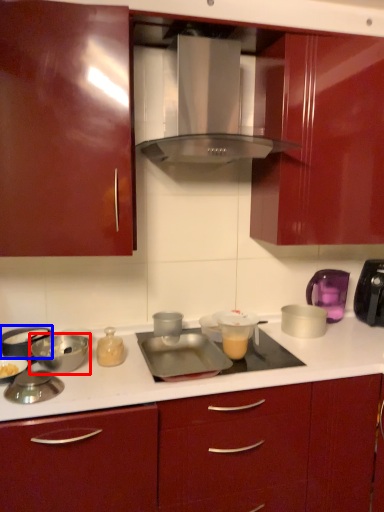
Question: Which of the following is the farthest to the observer, bowl (highlighted by a red box) or appliance (highlighted by a blue box)?

Choices:
 (A) bowl
 (B) appliance

Answer: (B)